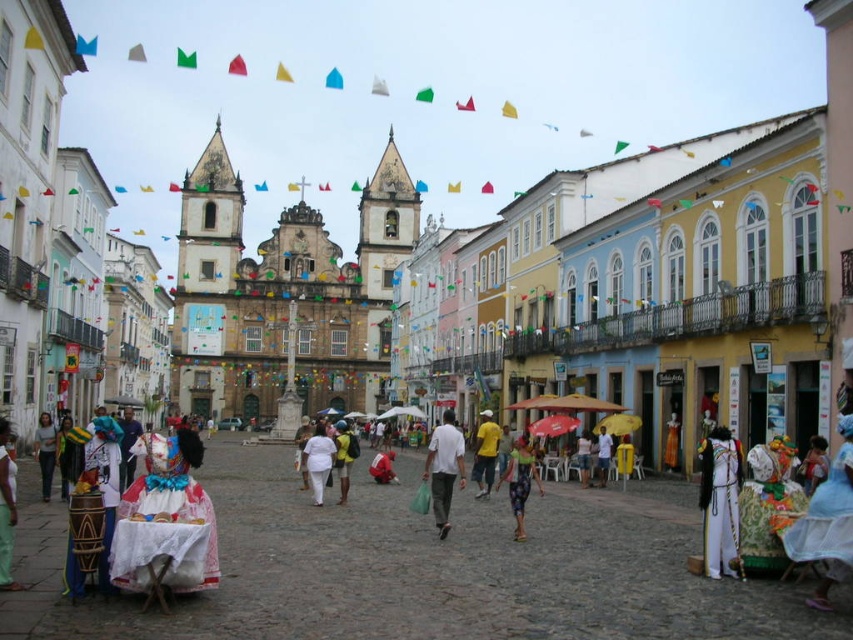
You are a photographer standing in the historic town square and see a white cotton dress at center and a yellow matte shirt at center. Which clothing item is positioned to the left when facing the square?

The white cotton dress at center is to the left of the yellow matte shirt at center.

You are standing at the center of the square and see a point marked at coordinates (x=519, y=481). What object does this point correspond to?

The point at coordinates (x=519, y=481) corresponds to the multicolored fabric dress at center.

You are a photographer standing in the historic town square and want to capture both the white matte costume at lower right and the yellow matte shirt at center in a single photo. Which of the two items should you focus on first to ensure they are both in frame?

The white matte costume at lower right is taller than the yellow matte shirt at center, so you should focus on the white matte costume at lower right first to ensure both are in frame.